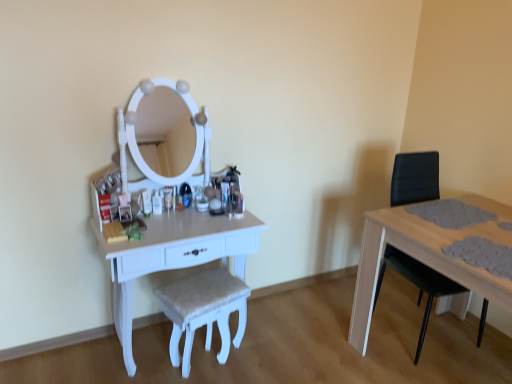
You are a GUI agent. You are given a task and a screenshot of the screen. Output one action in this format:
    pyautogui.click(x=<x>, y=<y>)
    Task: Click on the vacant space that's between white textured stool at center and black leather swivel chair at right
    
    Given the screenshot: What is the action you would take?
    pyautogui.click(x=322, y=352)